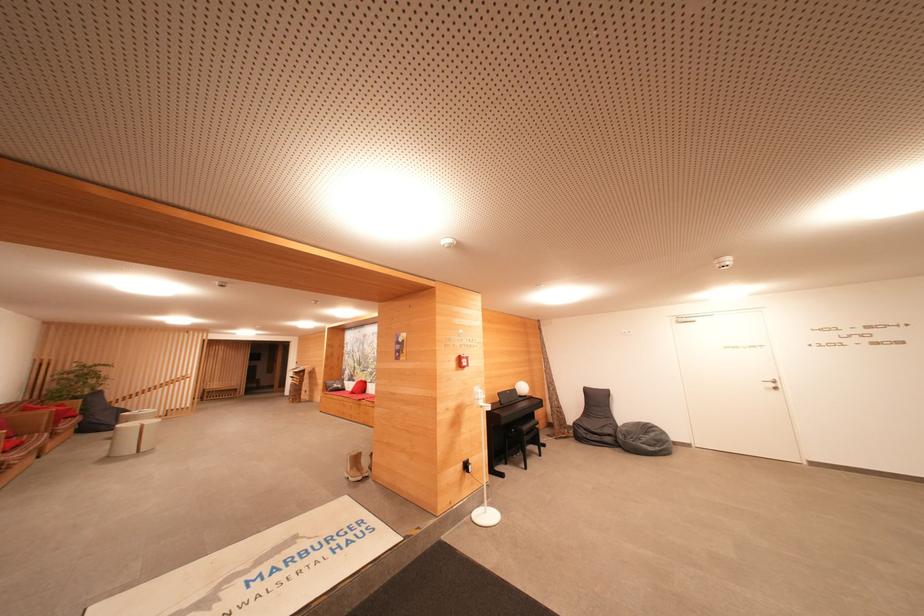
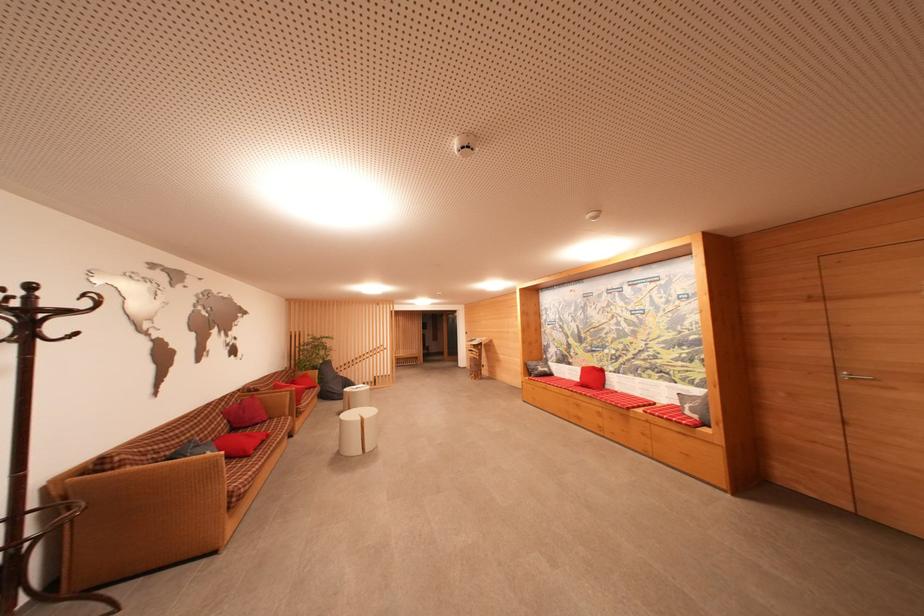
Which direction would the cameraman need to move to produce the second image?

The cameraman moved toward left, forward.